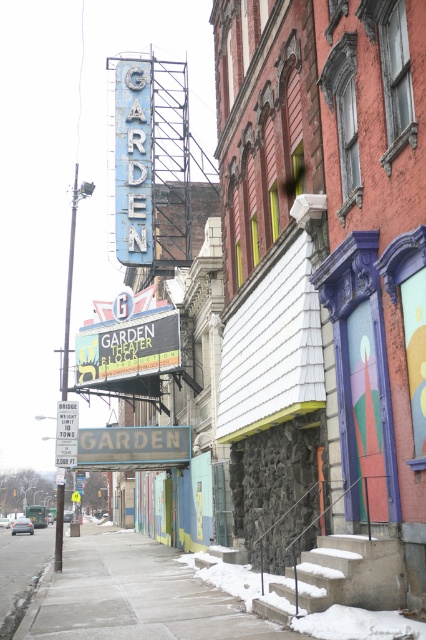
Question: Which point appears farthest from the camera in this image?

Choices:
 (A) (69, 413)
 (B) (37, 634)

Answer: (A)

Question: In this image, where is concrete sidewalk at lower center located relative to blue metallic sign at center?

Choices:
 (A) above
 (B) below

Answer: (B)

Question: Is the position of concrete sidewalk at lower center less distant than that of metallic reflective parking sign at center?

Choices:
 (A) no
 (B) yes

Answer: (B)

Question: Which point is closer to the camera?

Choices:
 (A) (169, 612)
 (B) (127, 428)
 (C) (74, 445)

Answer: (A)

Question: Which of the following is the farthest from the observer?

Choices:
 (A) concrete sidewalk at lower center
 (B) blue metallic sign at center
 (C) metallic reflective parking sign at center

Answer: (B)

Question: Is blue metallic sign at center positioned before metallic reflective parking sign at center?

Choices:
 (A) yes
 (B) no

Answer: (B)